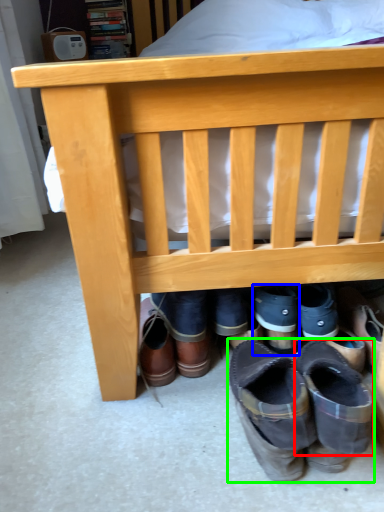
Question: Which is nearer to the shoe (highlighted by a red box)? footwear (highlighted by a blue box) or footwear (highlighted by a green box).

Choices:
 (A) footwear
 (B) footwear

Answer: (B)